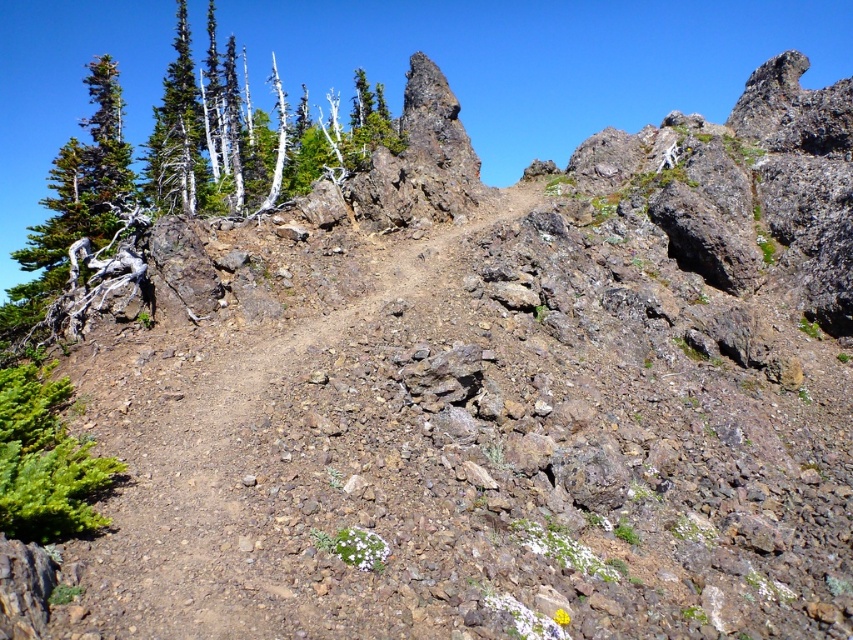
Question: Does green matte tree at upper left come in front of brown dirt track at center?

Choices:
 (A) yes
 (B) no

Answer: (B)

Question: Among these objects, which one is farthest from the camera?

Choices:
 (A) brown dirt track at center
 (B) green matte tree at upper left

Answer: (B)

Question: Which point is closer to the camera taking this photo?

Choices:
 (A) (343, 124)
 (B) (433, 237)

Answer: (B)

Question: Where is green matte tree at upper left located in relation to brown dirt track at center in the image?

Choices:
 (A) left
 (B) right

Answer: (A)

Question: Can you confirm if green matte tree at upper left is thinner than brown dirt track at center?

Choices:
 (A) yes
 (B) no

Answer: (B)